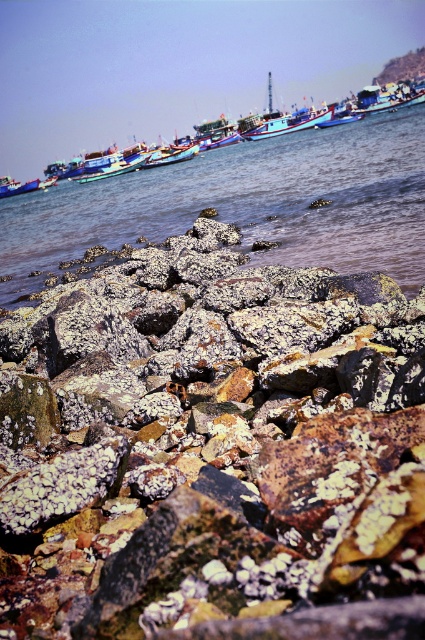
You are standing at the lower edge of the rocky shoreline in the image. You want to take a photo of the blue painted wooden boat at upper center. In which direction should you point your camera to capture it?

The blue painted wooden boat at upper center is located at point [81,163] in the image. Since you are at the lower edge of the rocky shoreline, you should point your camera upward and slightly to the left to capture it.

You are standing on the rocky shoreline and see a point marked at coordinates (289, 124). What object is located at this point?

The point at coordinates (289, 124) marks the blue painted wooden boat at center.